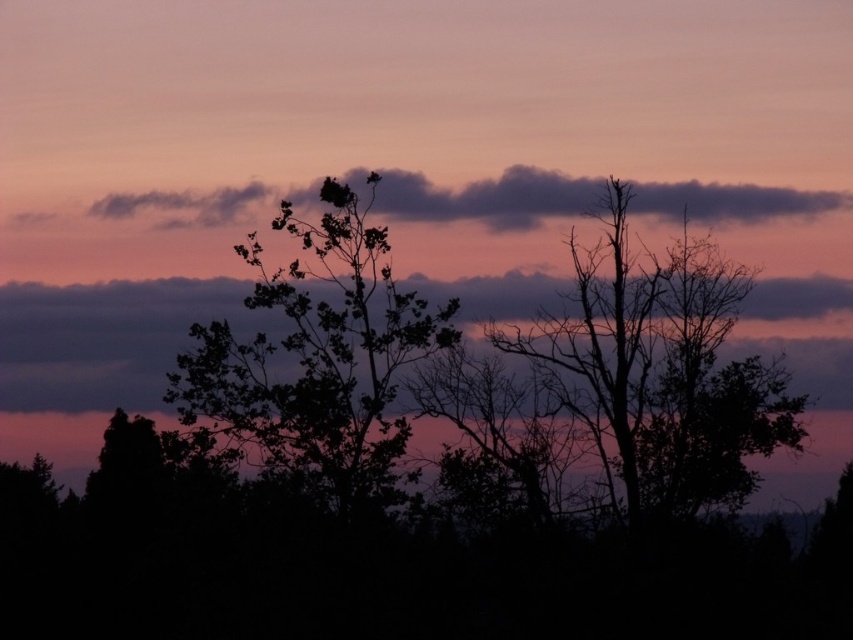
Does silhouette bare tree at right appear over dark purple cloud at upper center?

No, silhouette bare tree at right is not above dark purple cloud at upper center.

Is silhouette bare tree at right below dark purple cloud at upper center?

Yes, silhouette bare tree at right is below dark purple cloud at upper center.

I want to click on silhouette bare tree at right, so click(x=663, y=369).

Does silhouette leafy tree at center have a greater width compared to dark purple cloud at upper center?

No, silhouette leafy tree at center is not wider than dark purple cloud at upper center.

This screenshot has width=853, height=640. What are the coordinates of `silhouette leafy tree at center` in the screenshot? It's located at (317, 356).

Is point (347, 380) in front of point (540, 170)?

Yes, point (347, 380) is closer to viewer.

I want to click on silhouette leafy tree at center, so click(x=317, y=356).

Who is shorter, silhouette bare tree at right or silhouette leafy tree at center?

Standing shorter between the two is silhouette leafy tree at center.

Who is more forward, (686, 474) or (225, 385)?

Point (225, 385) is in front.

Identify the location of silhouette bare tree at right. Image resolution: width=853 pixels, height=640 pixels. (663, 369).

Find the location of a particular element. silhouette bare tree at right is located at coordinates (663, 369).